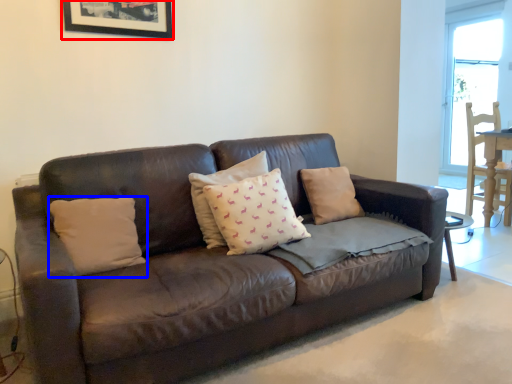
Question: Which object is closer to the camera taking this photo, picture frame (highlighted by a red box) or pillow (highlighted by a blue box)?

Choices:
 (A) picture frame
 (B) pillow

Answer: (B)